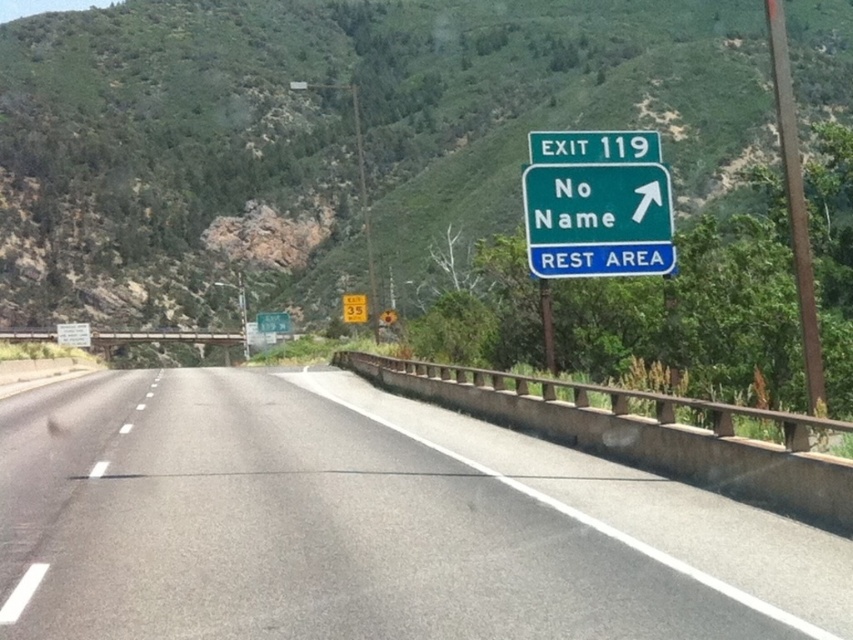
Is point (328, 586) less distant than point (596, 131)?

That is True.

This screenshot has height=640, width=853. Identify the location of gray asphalt road at center. coord(367,525).

Between gray asphalt road at center and green glossy sign at upper right, which one appears on the left side from the viewer's perspective?

Positioned to the left is gray asphalt road at center.

Is gray asphalt road at center taller than green glossy sign at upper right?

Yes.

You are a GUI agent. You are given a task and a screenshot of the screen. Output one action in this format:
    pyautogui.click(x=<x>, y=<y>)
    Task: Click on the gray asphalt road at center
    Image resolution: width=853 pixels, height=640 pixels.
    Given the screenshot: What is the action you would take?
    pyautogui.click(x=367, y=525)

This screenshot has height=640, width=853. In order to click on gray asphalt road at center in this screenshot , I will do `click(367, 525)`.

Which is behind, point (459, 76) or point (631, 136)?

The point (459, 76) is more distant.

Between green forested mountain at upper center and green metallic sign at upper right, which one has more height?

With more height is green forested mountain at upper center.

Between point (80, 284) and point (635, 131), which one is positioned in front?

Point (635, 131)

Find the location of a particular element. The width and height of the screenshot is (853, 640). green forested mountain at upper center is located at coordinates (328, 134).